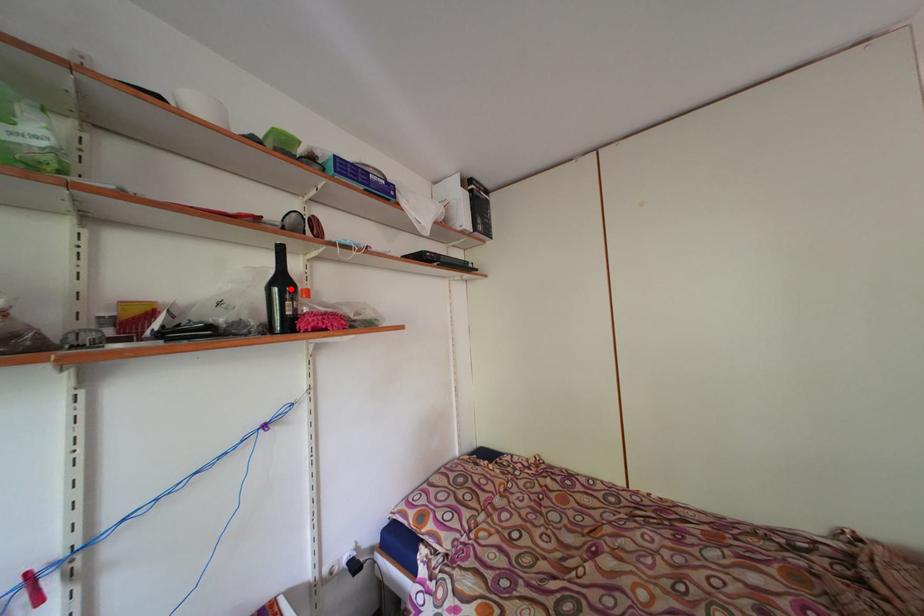
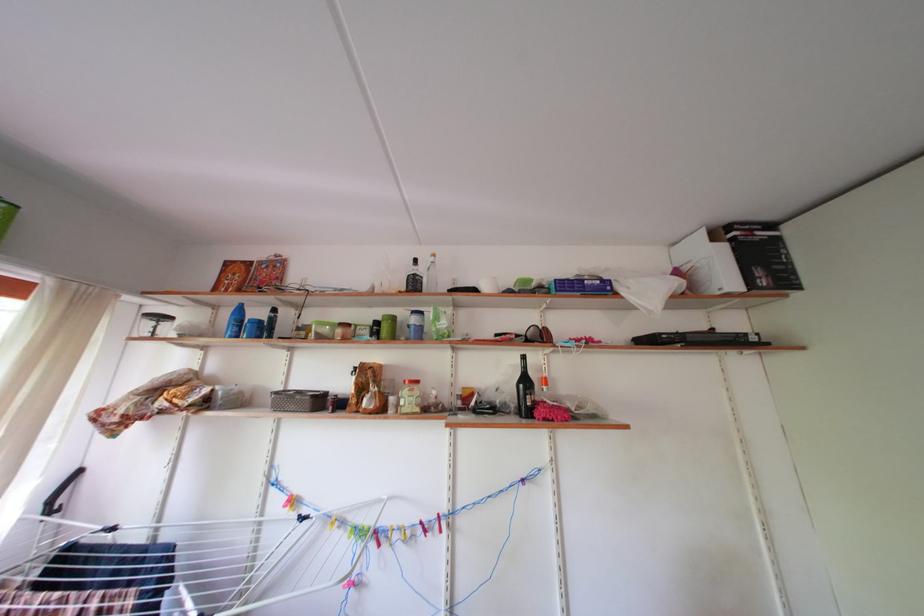
In the second image, find the point that corresponds to the highlighted location in the first image.

(533, 387)